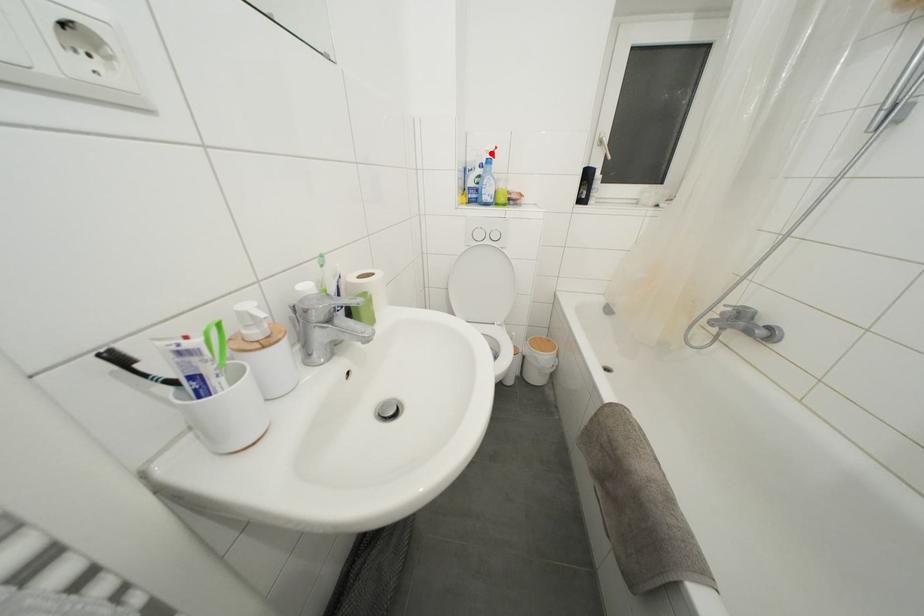
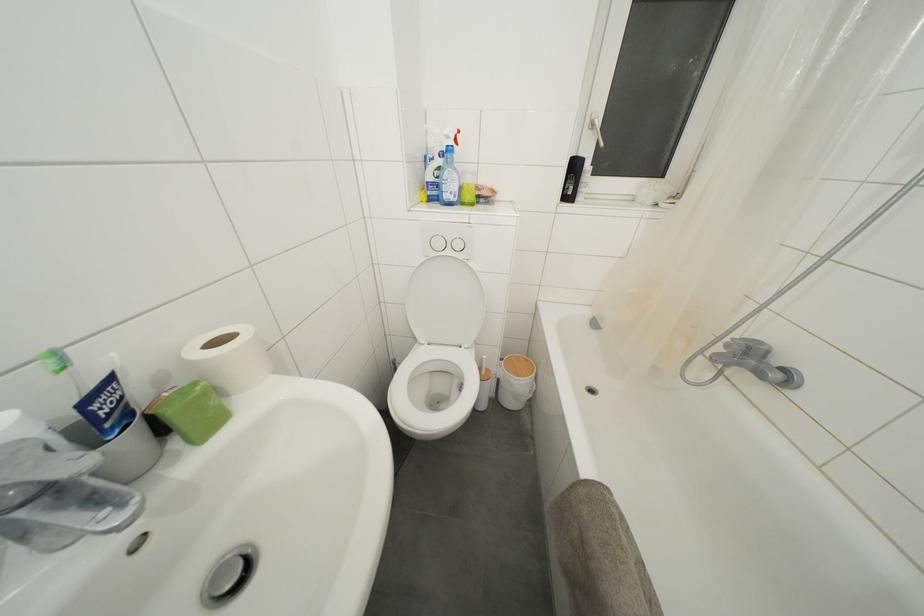
In the second image, find the point that corresponds to the highlighted location in the first image.

(450, 138)